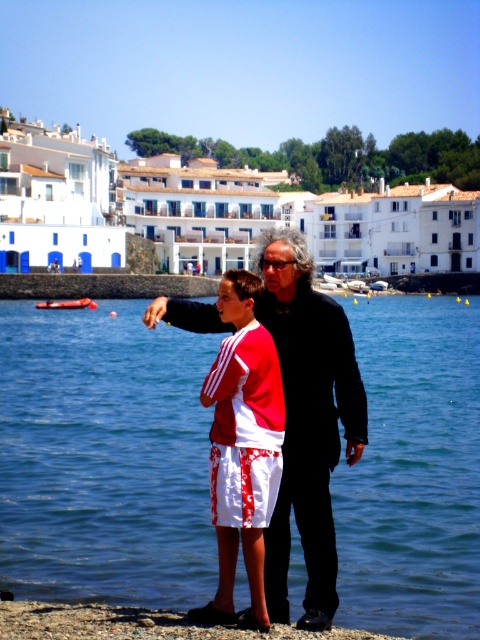
Is blue water at center in front of black matte jacket at center?

No, blue water at center is further to the viewer.

Can you confirm if blue water at center is positioned below black matte jacket at center?

Yes.

Identify the location of blue water at center. The height and width of the screenshot is (640, 480). (104, 458).

Find the location of a particular element. The image size is (480, 640). blue water at center is located at coordinates (104, 458).

Is black matte jacket at center closer to camera compared to white cotton shorts at center?

That is False.

Is point (290, 440) less distant than point (255, 337)?

That is False.

This screenshot has width=480, height=640. What do you see at coordinates (308, 420) in the screenshot?
I see `black matte jacket at center` at bounding box center [308, 420].

This screenshot has width=480, height=640. What are the coordinates of `black matte jacket at center` in the screenshot? It's located at (308, 420).

Is blue water at center shorter than white cotton shorts at center?

No.

Who is more forward, (182, 516) or (244, 312)?

Positioned in front is point (244, 312).

Where is `blue water at center`? The image size is (480, 640). blue water at center is located at coordinates tap(104, 458).